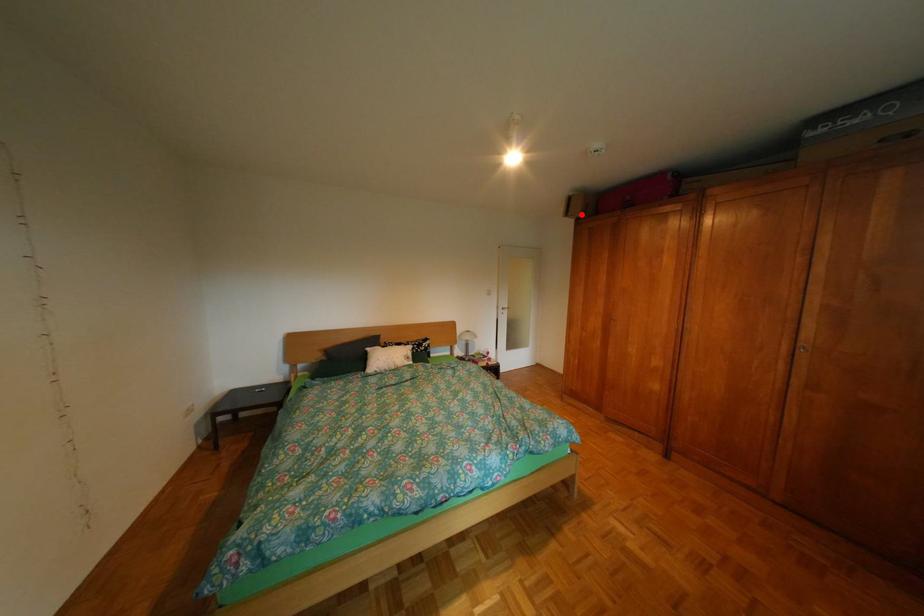
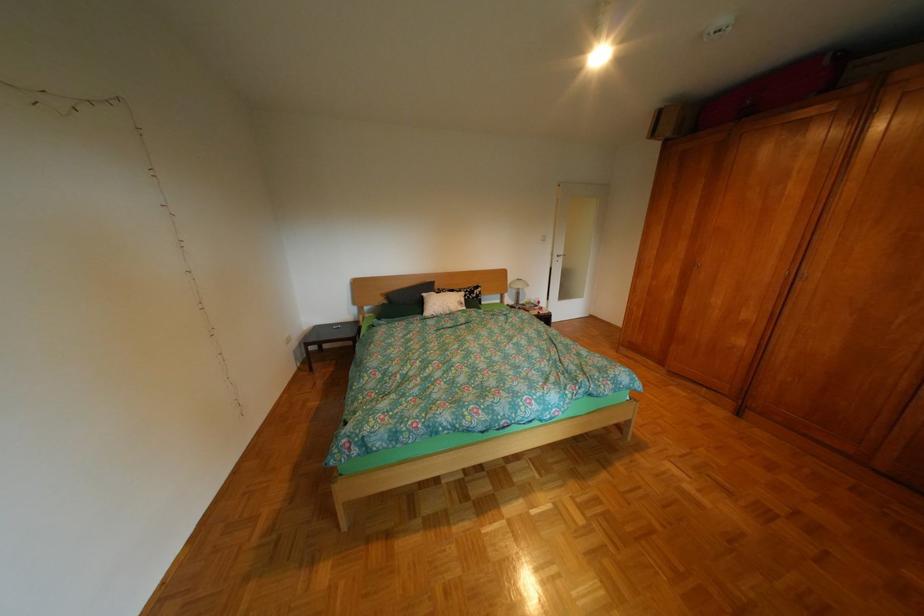
Where in the second image is the point corresponding to the highlighted location from the first image?

(667, 136)